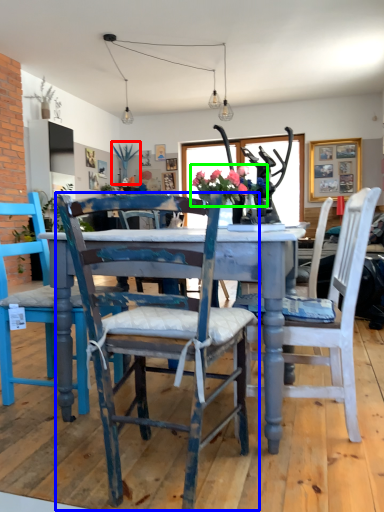
Question: Considering the real-world distances, which object is farthest from plant (highlighted by a red box)? chair (highlighted by a blue box) or floral arrangement (highlighted by a green box)?

Choices:
 (A) chair
 (B) floral arrangement

Answer: (A)